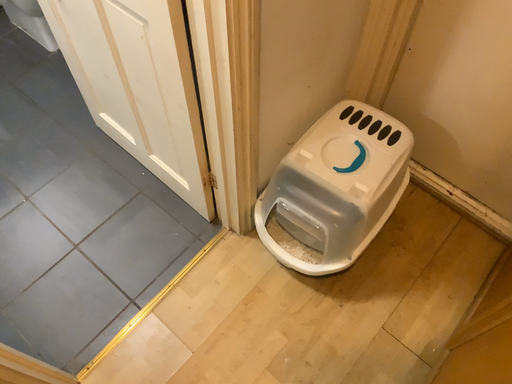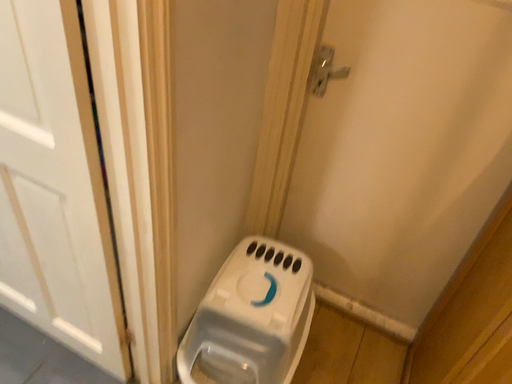
Question: Which way did the camera rotate in the video?

Choices:
 (A) rotated right
 (B) rotated left

Answer: (A)